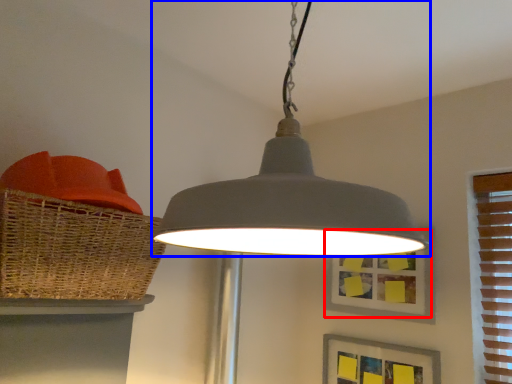
Question: Which object is closer to the camera taking this photo, picture frame (highlighted by a red box) or lamp (highlighted by a blue box)?

Choices:
 (A) picture frame
 (B) lamp

Answer: (B)